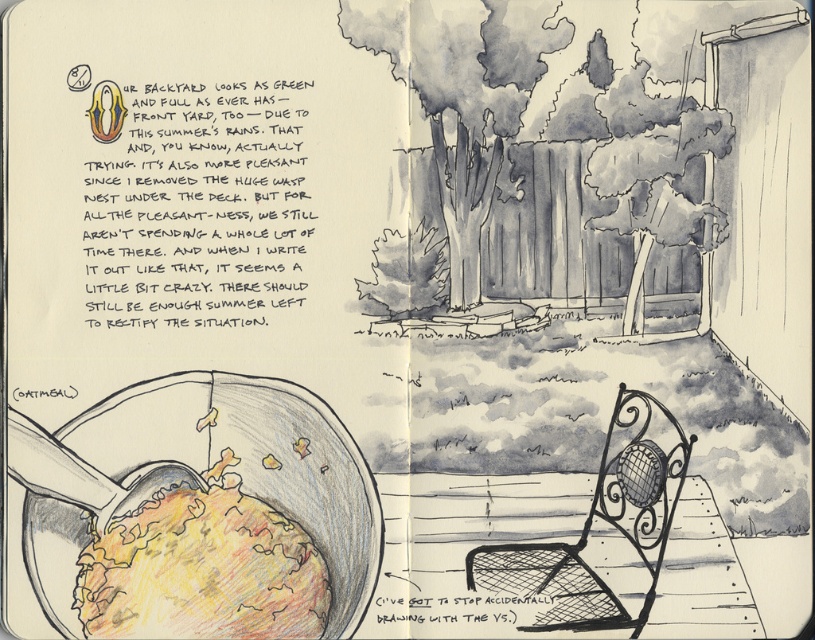
Question: Is yellow crumbly food at lower left thinner than wrought iron chair at center?

Choices:
 (A) yes
 (B) no

Answer: (B)

Question: Does yellow crumbly food at lower left have a smaller size compared to wrought iron chair at center?

Choices:
 (A) no
 (B) yes

Answer: (B)

Question: Which of the following is the farthest from the observer?

Choices:
 (A) wrought iron chair at center
 (B) yellow crumbly food at lower left

Answer: (B)

Question: Which of the following is the farthest from the observer?

Choices:
 (A) wrought iron chair at center
 (B) yellow crumbly food at lower left

Answer: (B)

Question: Does yellow crumbly food at lower left have a smaller size compared to wrought iron chair at center?

Choices:
 (A) no
 (B) yes

Answer: (B)